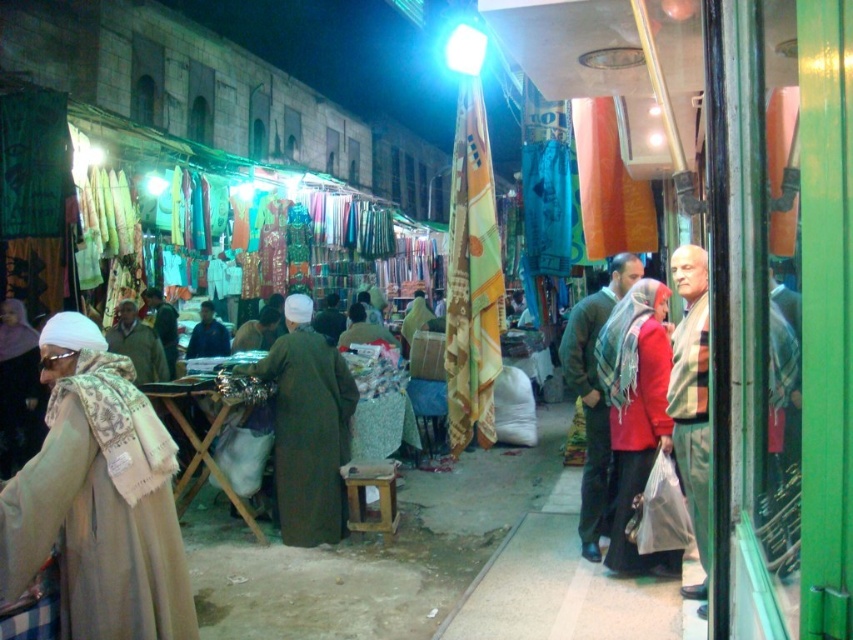
You are a customer at the night market and want to buy a light brown fabric at right and a brown woolen jacket at center. If you want to carry both items in a bag that can only hold items with a combined width of 1.2 meters, can you determine if their total width will exceed the bag capacity?

The light brown fabric at right has a width less than the brown woolen jacket at center. However, without knowing the exact widths of each item, it is impossible to determine if their combined width will exceed the 1.2 meter limit. You may need to check the individual measurements or choose one item to ensure it fits.

Based on the photo, you are a customer at the night market and want to purchase both the light brown fabric at right and the brown woolen jacket at center. You need to know which item is taller. Which one is taller?

The light brown fabric at right is much taller than the brown woolen jacket at center.